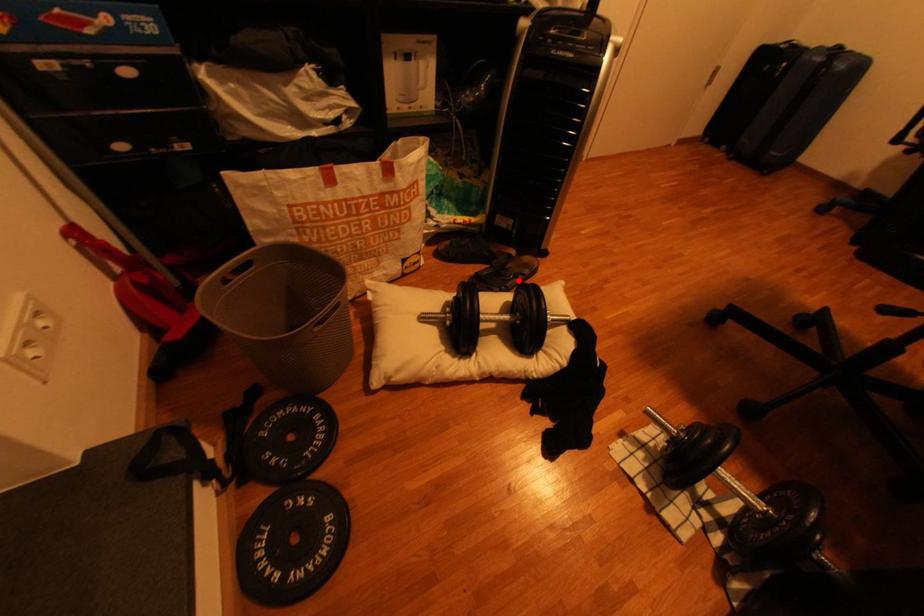
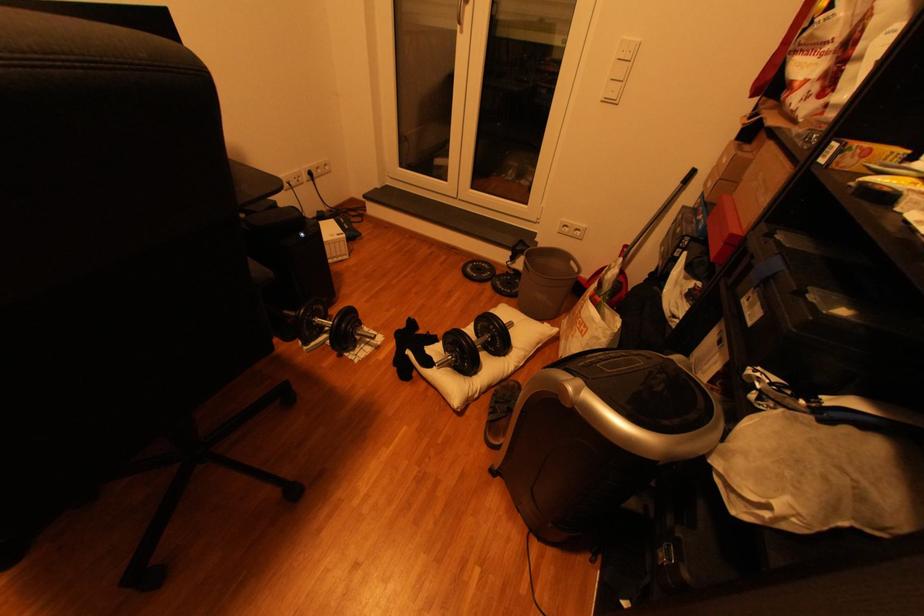
Question: A red point is marked in image1. In image2, is the corresponding 3D point closer to the camera or farther? Reply with the corresponding letter.

Choices:
 (A) The corresponding 3D point is closer.
 (B) The corresponding 3D point is farther.

Answer: (A)